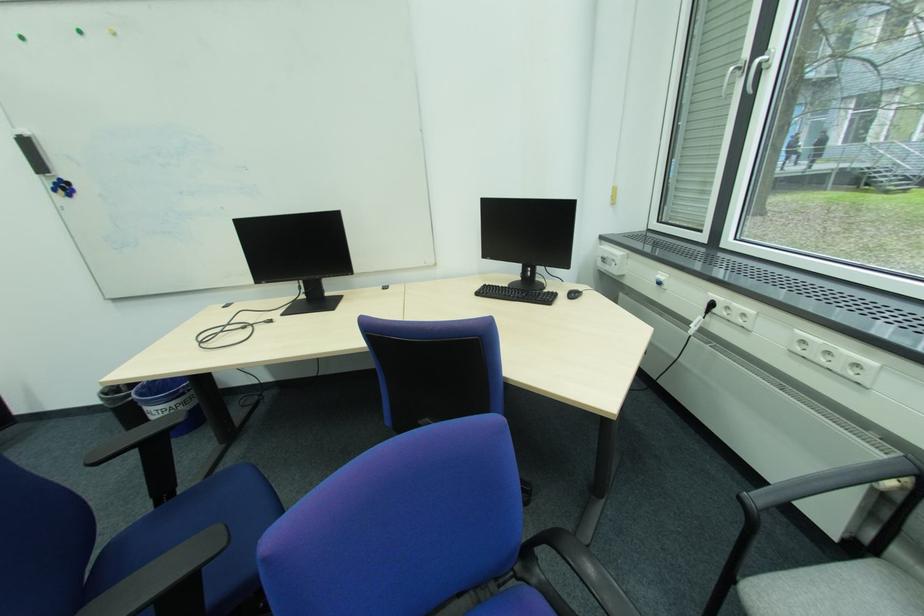
Describe the element at coordinates (757, 69) in the screenshot. I see `a white window handle` at that location.